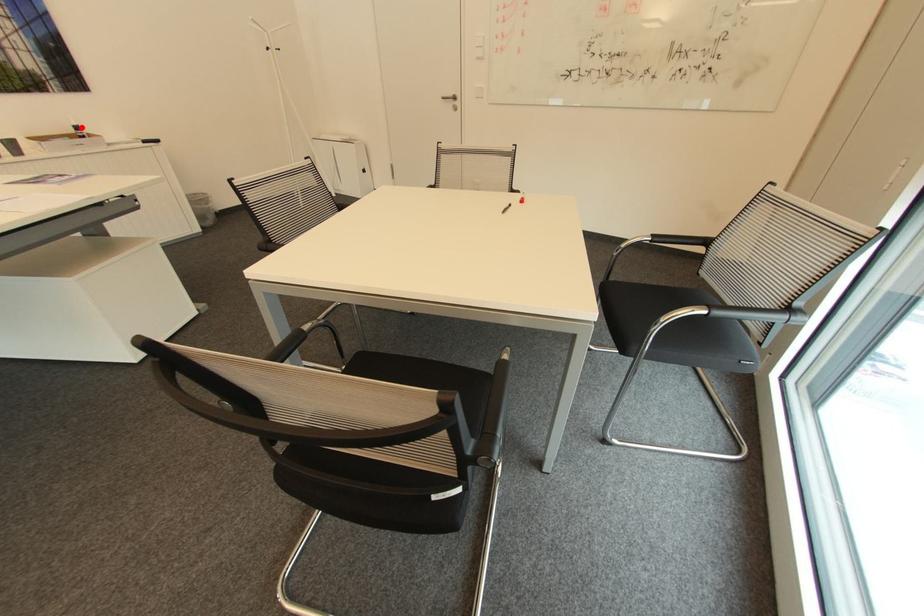
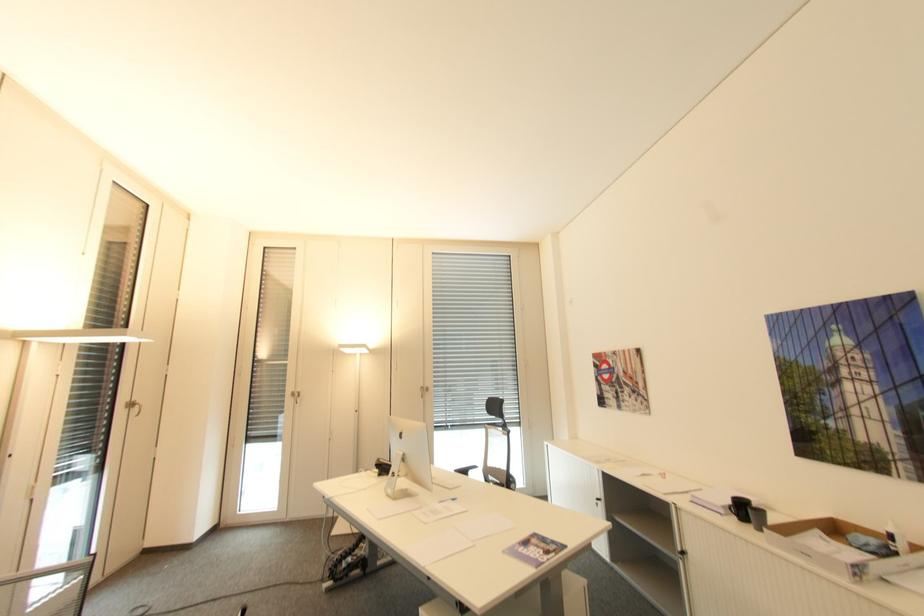
Question: I am providing you with two images of the same scene from different viewpoints. Given a red point in image1, look at the same physical point in image2. Is it:

Choices:
 (A) Closer to the viewpoint
 (B) Farther from the viewpoint

Answer: (A)